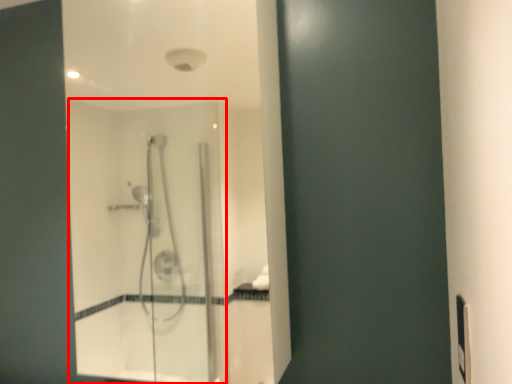
Question: From the image's perspective, what is the correct spatial relationship of screen door (annotated by the red box) in relation to electric outlet?

Choices:
 (A) below
 (B) above

Answer: (B)